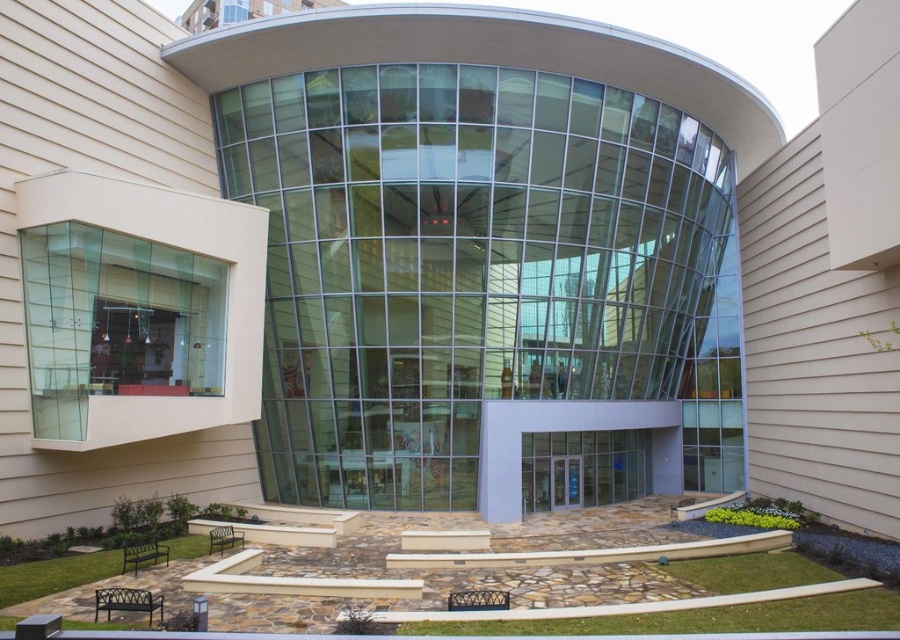
Question: Is the position of clear glass doors at center less distant than that of clear glass door at center?

Choices:
 (A) yes
 (B) no

Answer: (A)

Question: Does clear glass doors at center appear over clear glass door at center?

Choices:
 (A) yes
 (B) no

Answer: (A)

Question: Which object appears closest to the camera in this image?

Choices:
 (A) clear glass doors at center
 (B) clear glass door at center

Answer: (A)

Question: Which point is closer to the camera?

Choices:
 (A) (570, 432)
 (B) (570, 474)

Answer: (A)

Question: Observing the image, what is the correct spatial positioning of clear glass doors at center in reference to clear glass door at center?

Choices:
 (A) right
 (B) left

Answer: (A)